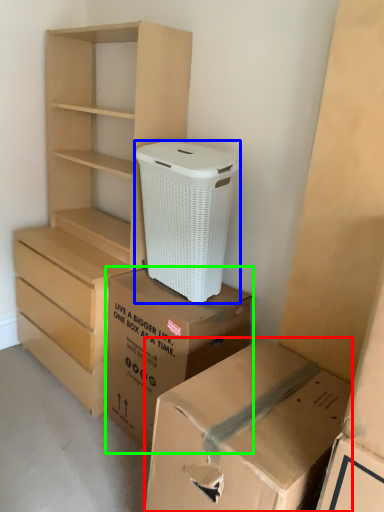
Question: Estimate the real-world distances between objects in this image. Which object is closer to box (highlighted by a red box), shoe box (highlighted by a blue box) or box (highlighted by a green box)?

Choices:
 (A) shoe box
 (B) box

Answer: (B)